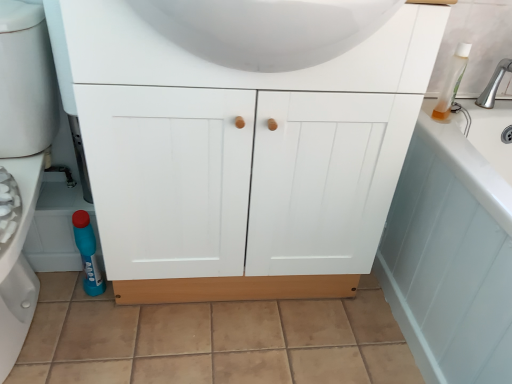
You are a GUI agent. You are given a task and a screenshot of the screen. Output one action in this format:
    pyautogui.click(x=<x>, y=<y>)
    Task: Click on the free space in front of white matte cabinet at center
    
    Given the screenshot: What is the action you would take?
    pyautogui.click(x=221, y=347)